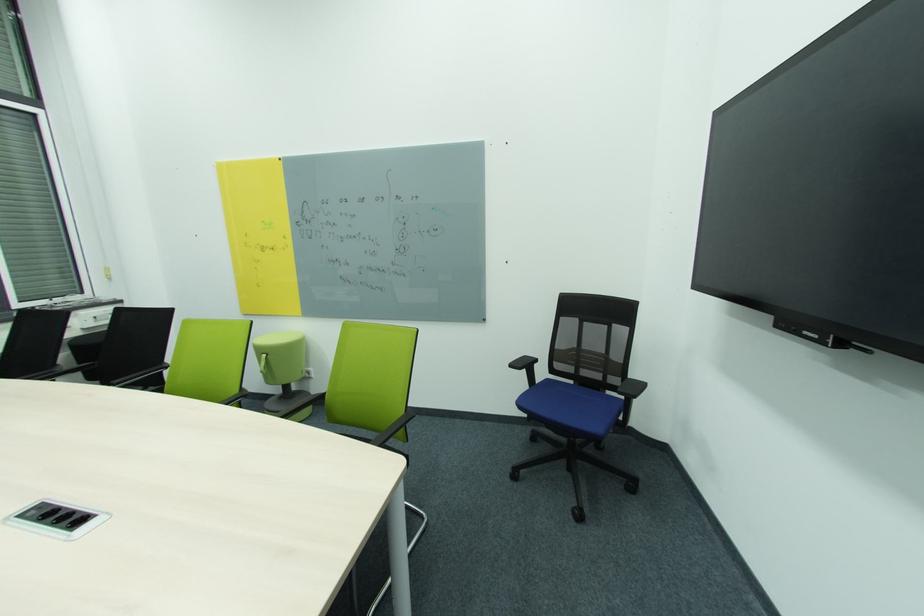
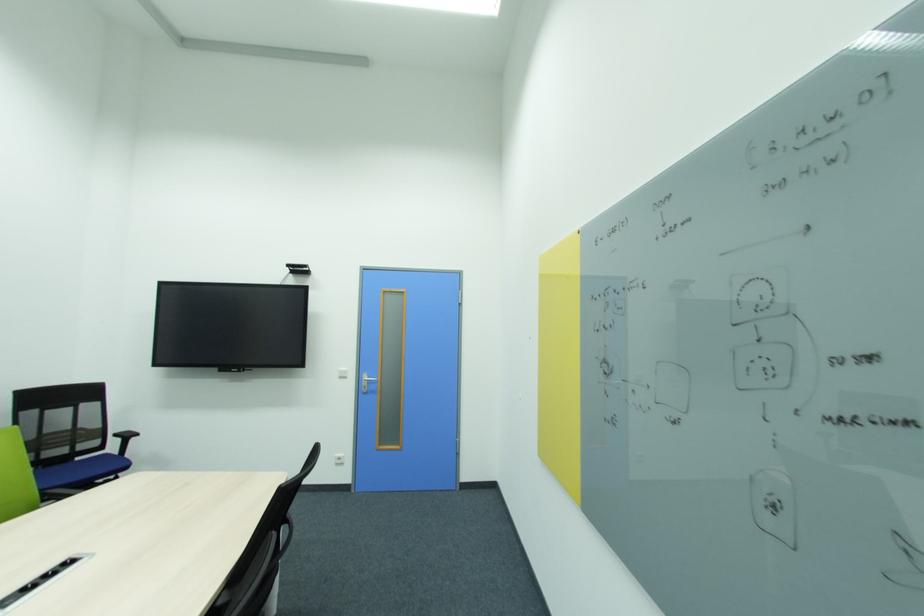
The point at (614,392) is marked in the first image. Where is the corresponding point in the second image?

(82, 460)